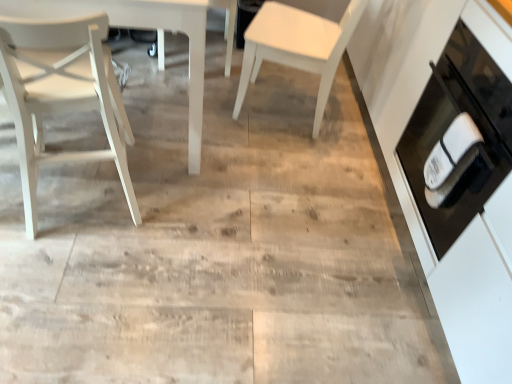
This screenshot has width=512, height=384. Identify the location of free space below white matte chair at left, which ranks as the first chair in left-to-right order (from a real-world perspective). (79, 195).